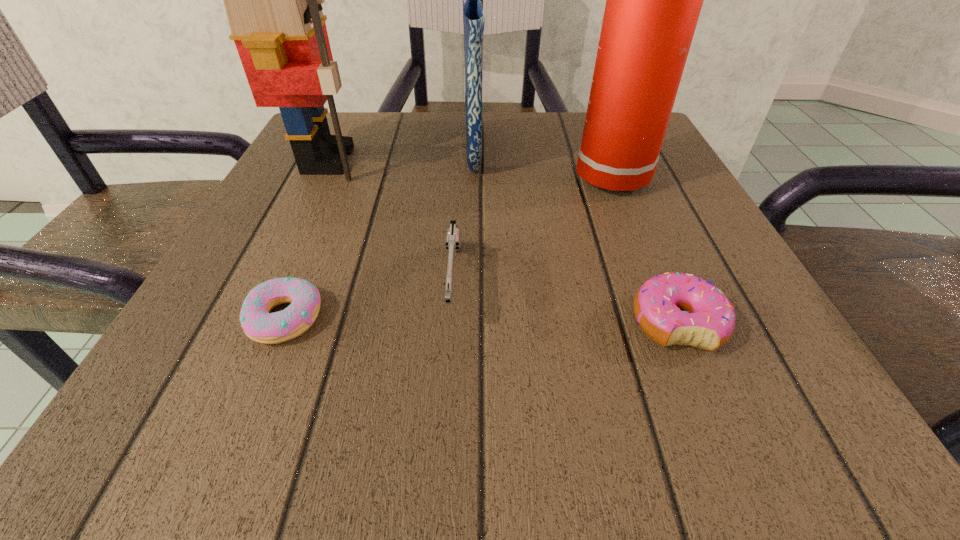
The height and width of the screenshot is (540, 960). What are the coordinates of `vacant space at the far right corner` in the screenshot? It's located at (577, 116).

Identify the location of vacant point located between the tallest object and the nutcracker. (401, 153).

Where is `vacant space in between the third shortest object and the fire extinguisher`? vacant space in between the third shortest object and the fire extinguisher is located at coordinates (540, 231).

Identify the location of free space between the fire extinguisher and the tallest object. click(x=551, y=162).

You are a GUI agent. You are given a task and a screenshot of the screen. Output one action in this format:
    pyautogui.click(x=<x>, y=<y>)
    Task: Click on the unoccupied position between the right doughnut and the nutcracker
    The width and height of the screenshot is (960, 540).
    Given the screenshot: What is the action you would take?
    pyautogui.click(x=502, y=241)

At what (x,y) coordinates should I click in order to perform the action: click on free spot between the fire extinguisher and the pistol. Please return your answer as a coordinate pair (x, y). The height and width of the screenshot is (540, 960). Looking at the image, I should click on (540, 231).

Image resolution: width=960 pixels, height=540 pixels. Identify the location of free space that is in between the nutcracker and the left doughnut. (307, 239).

This screenshot has width=960, height=540. In order to click on free space between the pistol and the left doughnut in this screenshot , I will do `click(370, 301)`.

Identify the location of free space between the pistol and the right doughnut. This screenshot has width=960, height=540. (565, 303).

At what (x,y) coordinates should I click in order to perform the action: click on vacant area that lies between the fire extinguisher and the shopping bag. Please return your answer as a coordinate pair (x, y). This screenshot has height=540, width=960. Looking at the image, I should click on (551, 162).